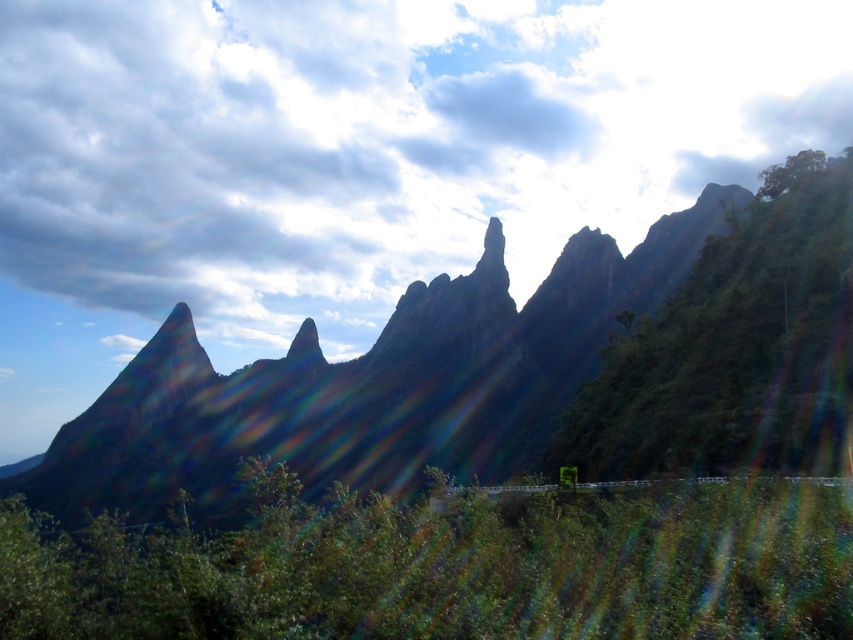
Question: Based on their relative distances, which object is farther from the green leafy bush at lower center?

Choices:
 (A) white fluffy cloud at upper center
 (B) rugged rock formation at center

Answer: (A)

Question: Where is white fluffy cloud at upper center located in relation to rugged rock formation at center in the image?

Choices:
 (A) above
 (B) below

Answer: (A)

Question: Which of the following is the farthest from the observer?

Choices:
 (A) white fluffy cloud at upper center
 (B) rugged rock formation at center

Answer: (A)

Question: In this image, where is white fluffy cloud at upper center located relative to rugged rock formation at center?

Choices:
 (A) right
 (B) left

Answer: (A)

Question: Which object is positioned farthest from the rugged rock formation at center?

Choices:
 (A) green leafy bush at lower center
 (B) white fluffy cloud at upper center

Answer: (B)

Question: Does white fluffy cloud at upper center have a smaller size compared to green leafy bush at lower center?

Choices:
 (A) no
 (B) yes

Answer: (A)